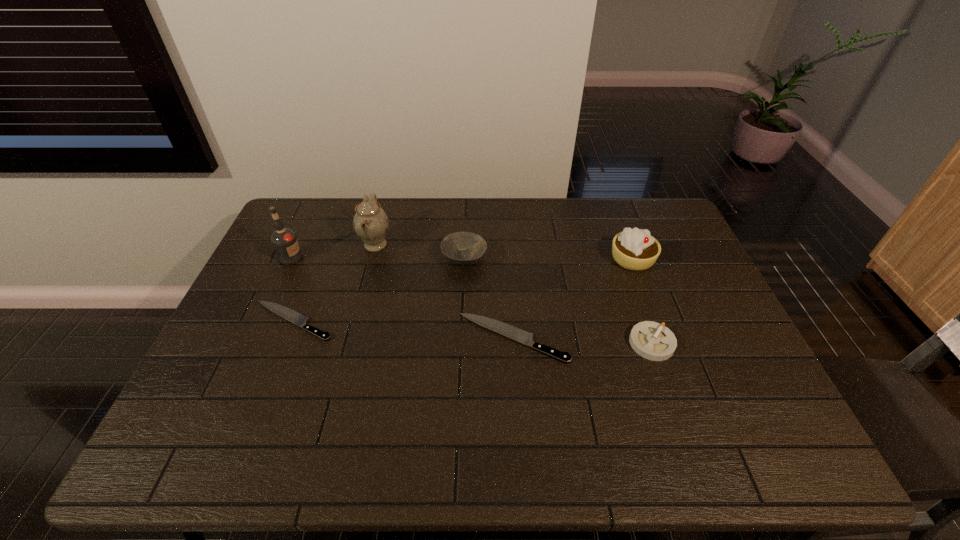
This screenshot has height=540, width=960. Find the location of `vacant area at the far edge`. vacant area at the far edge is located at coordinates (512, 231).

Where is `vacant space at the near edge of the desktop`? vacant space at the near edge of the desktop is located at coordinates (497, 393).

I want to click on vacant space at the left edge, so click(238, 345).

I want to click on free region at the right edge, so click(x=693, y=285).

In the image, there is a desktop. At what (x,y) coordinates should I click in order to perform the action: click on vacant space at the far left corner. Please return your answer as a coordinate pair (x, y). The height and width of the screenshot is (540, 960). Looking at the image, I should click on (324, 211).

Identify the location of free spot between the vodka and the fourth shortest object. The width and height of the screenshot is (960, 540). (377, 258).

Where is `vacant region between the shortest object and the chinaware`? This screenshot has width=960, height=540. vacant region between the shortest object and the chinaware is located at coordinates (334, 283).

In order to click on vacant area between the chinaware and the whipped cream in this screenshot , I will do `click(504, 252)`.

Locate an element on the screen. The width and height of the screenshot is (960, 540). free space between the whipped cream and the chinaware is located at coordinates (504, 252).

This screenshot has width=960, height=540. In order to click on free spot between the taller steak knife and the chinaware in this screenshot , I will do `click(444, 292)`.